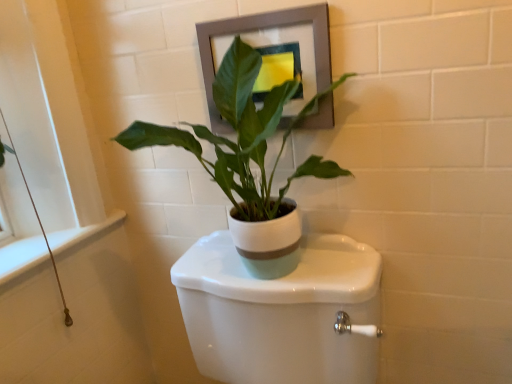
Question: Is the surface of white glossy toilet at center in direct contact with matte gray picture frame at upper center?

Choices:
 (A) yes
 (B) no

Answer: (B)

Question: Considering the relative sizes of white glossy toilet at center and matte gray picture frame at upper center in the image provided, is white glossy toilet at center shorter than matte gray picture frame at upper center?

Choices:
 (A) no
 (B) yes

Answer: (A)

Question: Considering the relative sizes of white glossy toilet at center and matte gray picture frame at upper center in the image provided, is white glossy toilet at center bigger than matte gray picture frame at upper center?

Choices:
 (A) no
 (B) yes

Answer: (B)

Question: Is matte gray picture frame at upper center located within white glossy toilet at center?

Choices:
 (A) yes
 (B) no

Answer: (B)

Question: Considering the relative positions of white glossy toilet at center and matte gray picture frame at upper center in the image provided, is white glossy toilet at center to the left of matte gray picture frame at upper center from the viewer's perspective?

Choices:
 (A) yes
 (B) no

Answer: (A)

Question: Choose the correct answer: Is white glossy toilet at center inside white matte pot at center or outside it?

Choices:
 (A) inside
 (B) outside

Answer: (B)

Question: From a real-world perspective, is white glossy toilet at center physically located above or below white matte pot at center?

Choices:
 (A) above
 (B) below

Answer: (B)

Question: In terms of size, does white glossy toilet at center appear bigger or smaller than white matte pot at center?

Choices:
 (A) small
 (B) big

Answer: (B)

Question: In terms of height, does white glossy toilet at center look taller or shorter compared to white matte pot at center?

Choices:
 (A) tall
 (B) short

Answer: (A)

Question: In terms of height, does white matte pot at center look taller or shorter compared to white glossy toilet at center?

Choices:
 (A) tall
 (B) short

Answer: (B)

Question: Visually, is white matte pot at center positioned to the left or to the right of white glossy toilet at center?

Choices:
 (A) right
 (B) left

Answer: (B)

Question: Considering their positions, is white matte pot at center located in front of or behind white glossy toilet at center?

Choices:
 (A) behind
 (B) front

Answer: (A)

Question: Looking at their shapes, would you say white matte pot at center is wider or thinner than white glossy toilet at center?

Choices:
 (A) wide
 (B) thin

Answer: (B)

Question: Considering the positions of white glossy toilet at center and matte gray picture frame at upper center in the image, is white glossy toilet at center bigger or smaller than matte gray picture frame at upper center?

Choices:
 (A) big
 (B) small

Answer: (A)

Question: From the image's perspective, is white glossy toilet at center located above or below matte gray picture frame at upper center?

Choices:
 (A) above
 (B) below

Answer: (B)